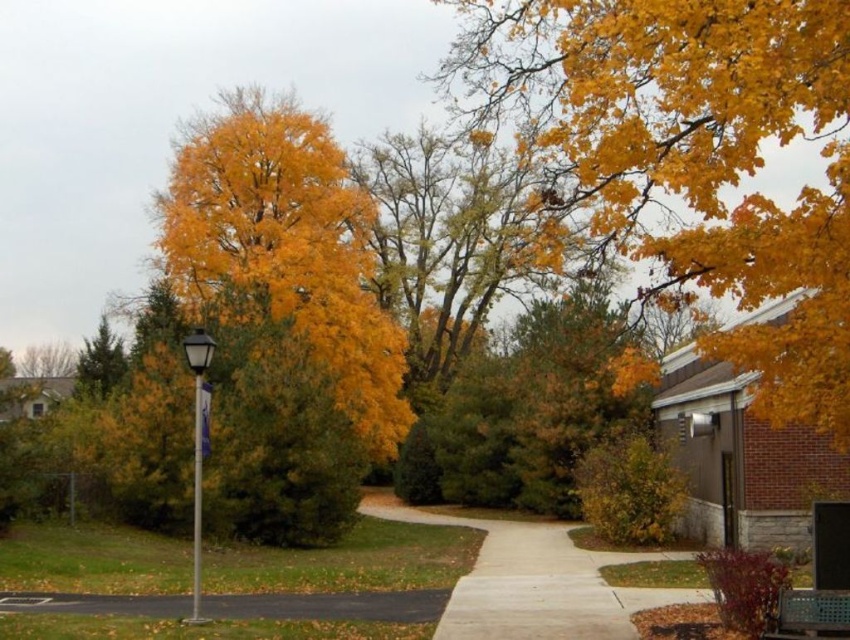
You are a photographer wanting to capture the wooden park bench at lower right without the golden yellow leaves at center blocking it. Based on the scene, where should you position yourself to achieve this?

The wooden park bench at lower right is behind golden yellow leaves at center. To avoid the leaves blocking the bench, move to a position where you can see behind the golden yellow leaves at center, such as moving to the right side of the path or adjusting your angle to look past them.

You are a gardener planning to place a 1.2 meter wide decorative stone along the path. You see the black asphalt pavement at lower left and the silver metallic street sign at left. Which object has a width that allows the stone to fit if placed next to it?

The black asphalt pavement at lower left has a width less than the silver metallic street sign at left. Since the stone is 1.2 meters wide, it can only fit next to the silver metallic street sign at left if its width is greater than 1.2 meters. However, the pavement is narrower, so the stone may not fit there. The street sign might have sufficient width depending on its actual measurement, but based on the given information, the pavement is narrower than the sign.